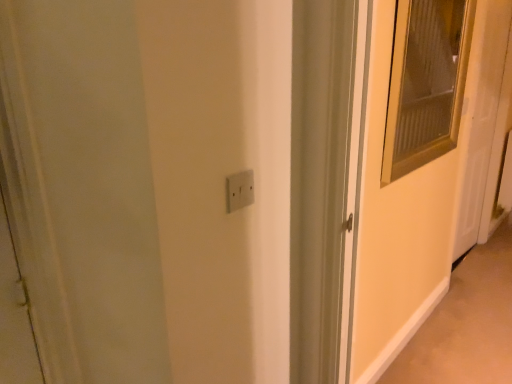
Question: Does white glossy door at right have a greater height compared to matte glass screen door at right?

Choices:
 (A) no
 (B) yes

Answer: (B)

Question: Is matte glass screen door at right surrounded by white glossy door at right?

Choices:
 (A) no
 (B) yes

Answer: (A)

Question: Is white glossy door at right positioned behind matte glass screen door at right?

Choices:
 (A) no
 (B) yes

Answer: (B)

Question: Does white glossy door at right have a greater width compared to matte glass screen door at right?

Choices:
 (A) no
 (B) yes

Answer: (B)

Question: Is white glossy door at right positioned with its back to matte glass screen door at right?

Choices:
 (A) no
 (B) yes

Answer: (A)

Question: Is point (496, 157) closer or farther from the camera than point (379, 274)?

Choices:
 (A) closer
 (B) farther

Answer: (B)

Question: From a real-world perspective, relative to matte glass screen door at right, is white glossy door at right vertically above or below?

Choices:
 (A) below
 (B) above

Answer: (A)

Question: Is white glossy door at right taller or shorter than matte glass screen door at right?

Choices:
 (A) tall
 (B) short

Answer: (A)

Question: Looking at their shapes, would you say white glossy door at right is wider or thinner than matte glass screen door at right?

Choices:
 (A) wide
 (B) thin

Answer: (A)

Question: Is beige carpet at lower right in front of or behind white glossy door at right in the image?

Choices:
 (A) front
 (B) behind

Answer: (A)

Question: In terms of size, does beige carpet at lower right appear bigger or smaller than white glossy door at right?

Choices:
 (A) small
 (B) big

Answer: (A)

Question: In terms of width, does beige carpet at lower right look wider or thinner when compared to white glossy door at right?

Choices:
 (A) thin
 (B) wide

Answer: (B)

Question: From the image's perspective, is beige carpet at lower right above or below white glossy door at right?

Choices:
 (A) above
 (B) below

Answer: (B)

Question: Would you say matte glass screen door at right is inside or outside beige carpet at lower right?

Choices:
 (A) inside
 (B) outside

Answer: (B)

Question: From the image's perspective, is matte glass screen door at right above or below beige carpet at lower right?

Choices:
 (A) below
 (B) above

Answer: (B)